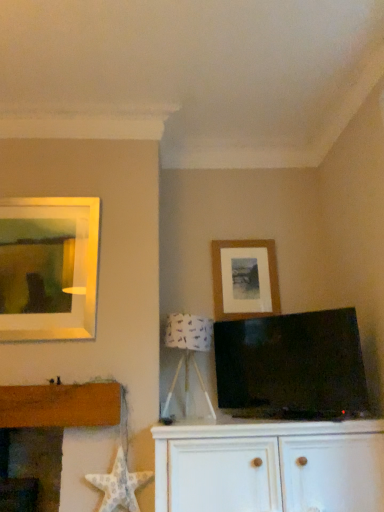
Question: In terms of height, does white wood cabinet at center look taller or shorter compared to matte black tv at center?

Choices:
 (A) tall
 (B) short

Answer: (B)

Question: From a real-world perspective, is white wood cabinet at center above or below matte black tv at center?

Choices:
 (A) above
 (B) below

Answer: (B)

Question: Based on their relative distances, which object is nearer to the white wood cabinet at center?

Choices:
 (A) matte black tv at center
 (B) white textured starfish at lower left
 (C) white fabric lampshade at center
 (D) wooden picture frame at upper right

Answer: (A)

Question: Which object is positioned closest to the white fabric lampshade at center?

Choices:
 (A) matte black tv at center
 (B) white wood cabinet at center
 (C) white textured starfish at lower left
 (D) wooden picture frame at upper right

Answer: (A)